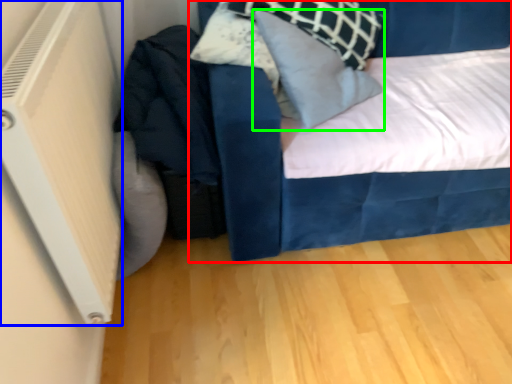
Question: Estimate the real-world distances between objects in this image. Which object is closer to bed (highlighted by a red box), air conditioning (highlighted by a blue box) or pillow (highlighted by a green box)?

Choices:
 (A) air conditioning
 (B) pillow

Answer: (B)